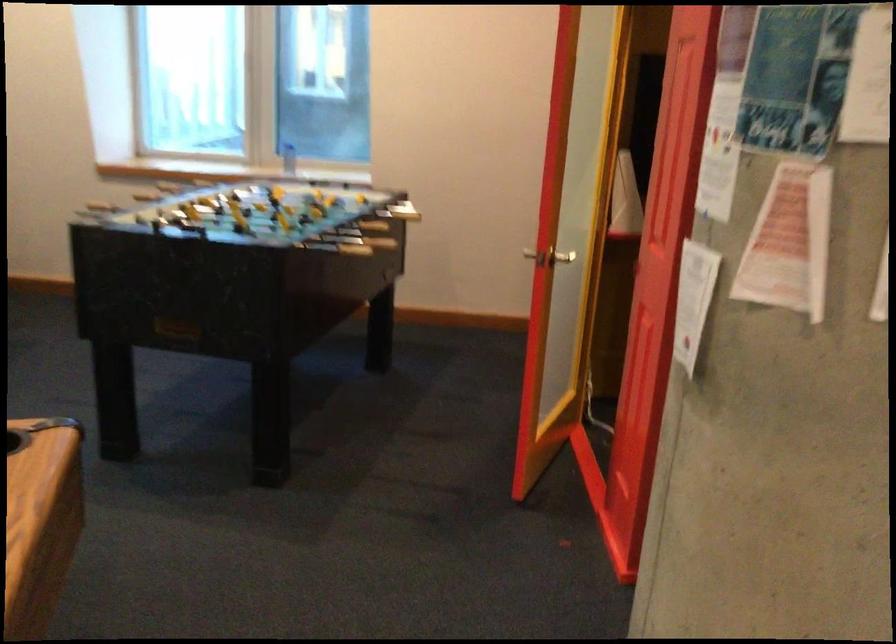
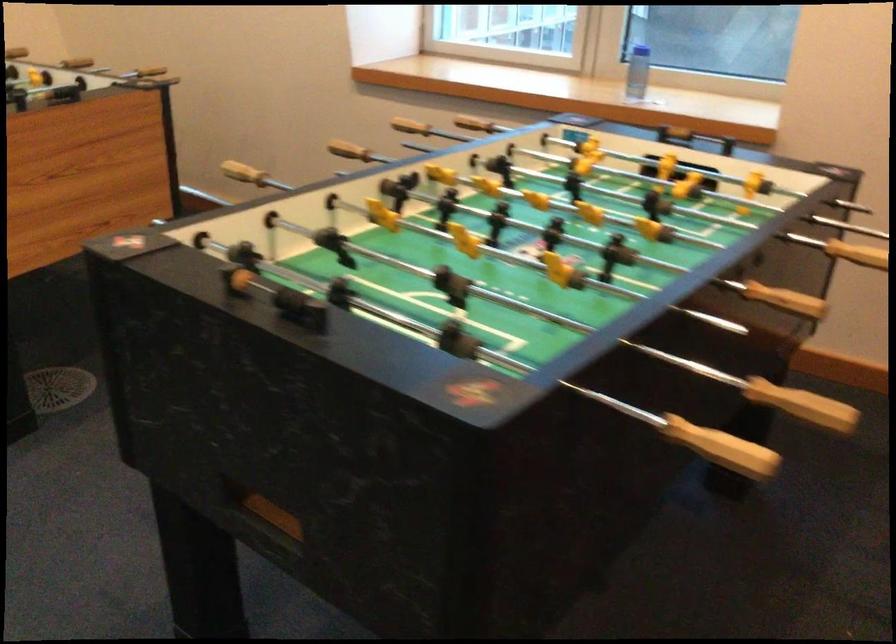
In the second image, find the point that corresponds to [325,187] in the first image.

(678, 172)